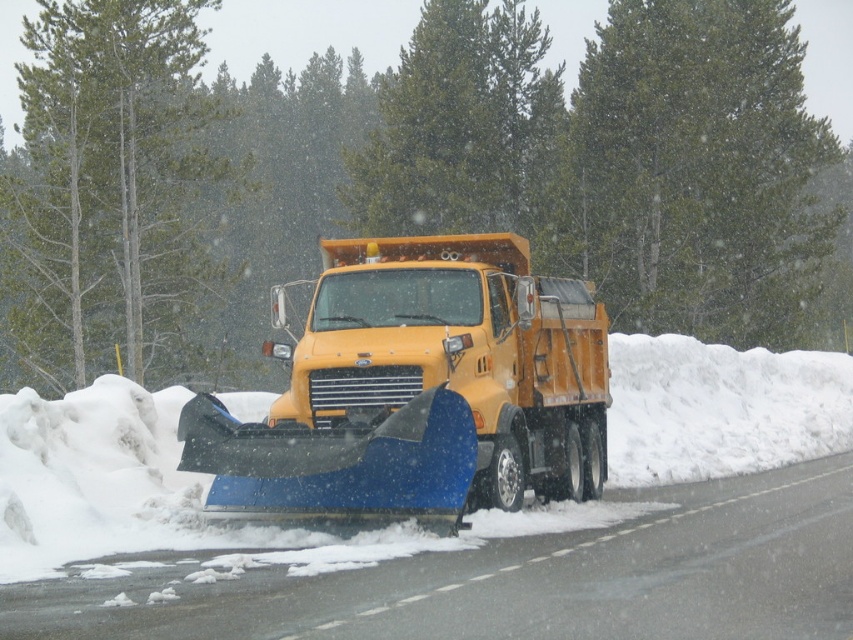
Can you confirm if green leafy tree at upper center is positioned below yellow matte truck at center?

Incorrect, green leafy tree at upper center is not positioned below yellow matte truck at center.

Is green leafy tree at upper center shorter than yellow matte truck at center?

In fact, green leafy tree at upper center may be taller than yellow matte truck at center.

I want to click on green leafy tree at upper center, so click(410, 176).

Who is more forward, (236, 432) or (653, 193)?

Point (236, 432) is in front.

Which is below, yellow matte truck at center or green textured tree at upper center?

Positioned lower is yellow matte truck at center.

The image size is (853, 640). What do you see at coordinates (419, 392) in the screenshot?
I see `yellow matte truck at center` at bounding box center [419, 392].

Locate an element on the screen. The height and width of the screenshot is (640, 853). yellow matte truck at center is located at coordinates (419, 392).

The height and width of the screenshot is (640, 853). What do you see at coordinates (410, 176) in the screenshot?
I see `green leafy tree at upper center` at bounding box center [410, 176].

Is green leafy tree at upper center thinner than green textured tree at center?

No.

Find the location of a particular element. green leafy tree at upper center is located at coordinates (410, 176).